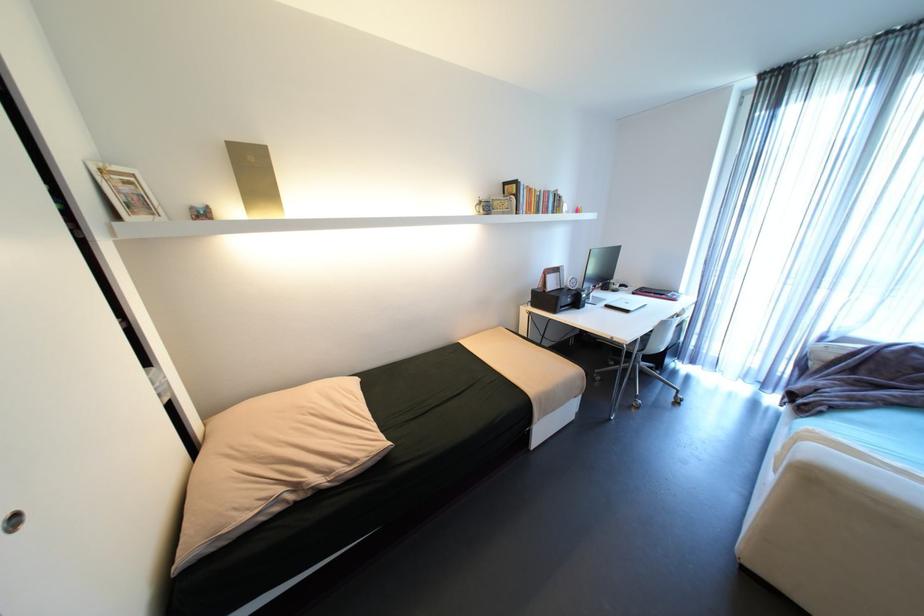
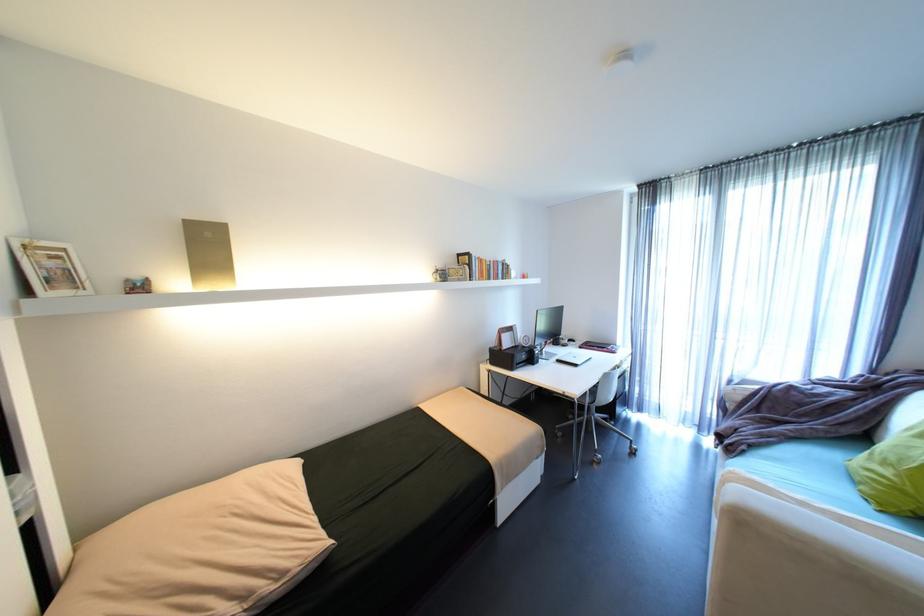
Locate, in the second image, the point that corresponds to (642,291) in the first image.

(589, 344)